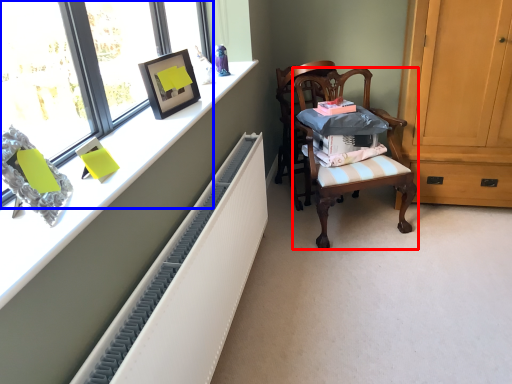
Question: Which object is closer to the camera taking this photo, chair (highlighted by a red box) or window (highlighted by a blue box)?

Choices:
 (A) chair
 (B) window

Answer: (B)